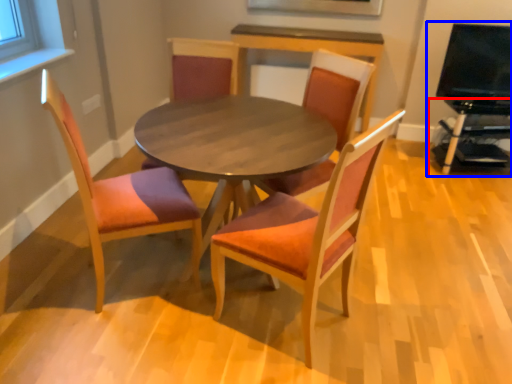
Question: Which object is closer to the camera taking this photo, entertainment center (highlighted by a red box) or entertainment center (highlighted by a blue box)?

Choices:
 (A) entertainment center
 (B) entertainment center

Answer: (B)